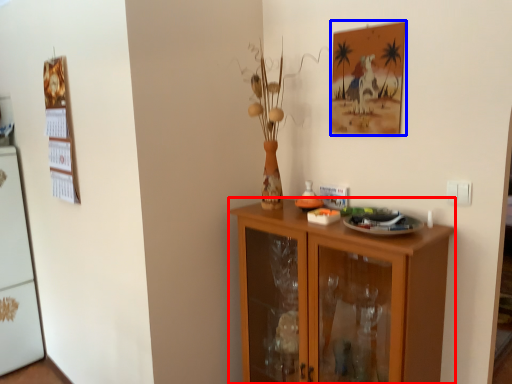
Question: Which of the following is the farthest to the observer, cabinetry (highlighted by a red box) or picture frame (highlighted by a blue box)?

Choices:
 (A) cabinetry
 (B) picture frame

Answer: (B)